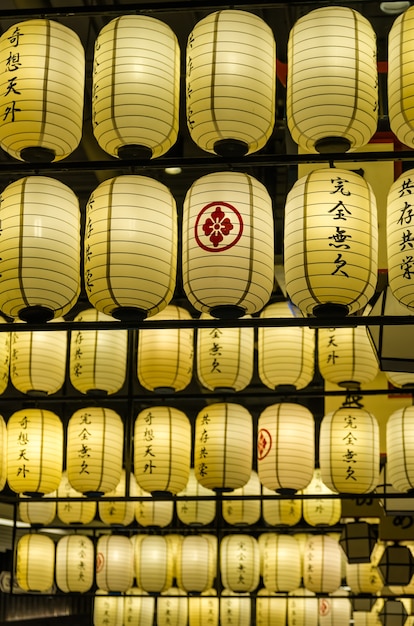
The image size is (414, 626). What are the coordinates of `black rack` in the screenshot? It's located at (218, 499).